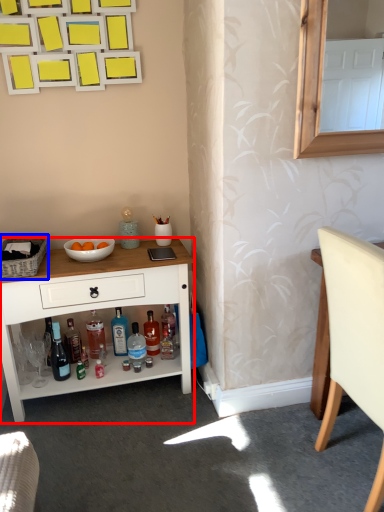
Question: Which point is further to the camera, desk (highlighted by a red box) or picnic basket (highlighted by a blue box)?

Choices:
 (A) desk
 (B) picnic basket

Answer: (A)